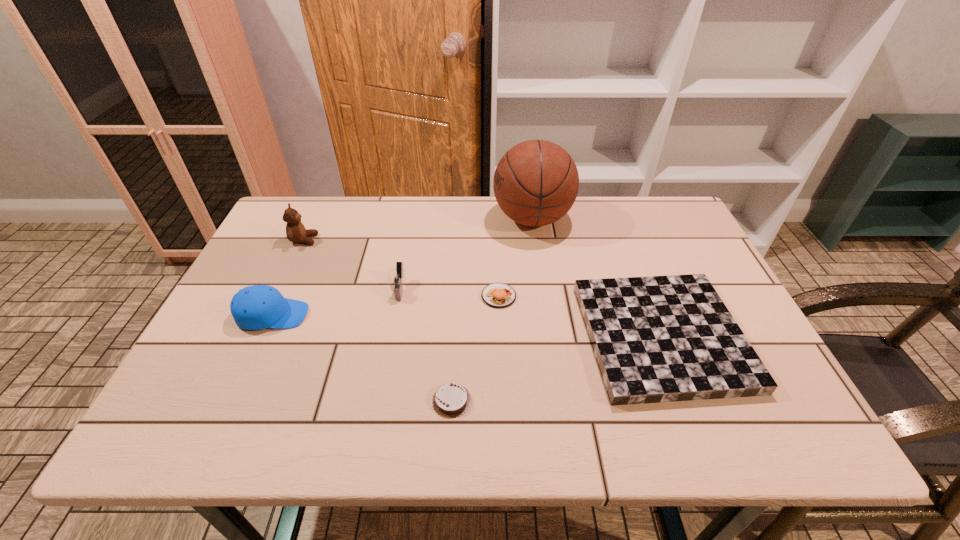
The height and width of the screenshot is (540, 960). What are the coordinates of `vacant space that satisfies the following two spatial constraints: 1. on the front-facing side of the shortest object; 2. on the left side of the cap` in the screenshot? It's located at (233, 401).

This screenshot has height=540, width=960. I want to click on blank space that satisfies the following two spatial constraints: 1. on the back side of the checkerboard; 2. on the front-facing side of the cap, so click(653, 315).